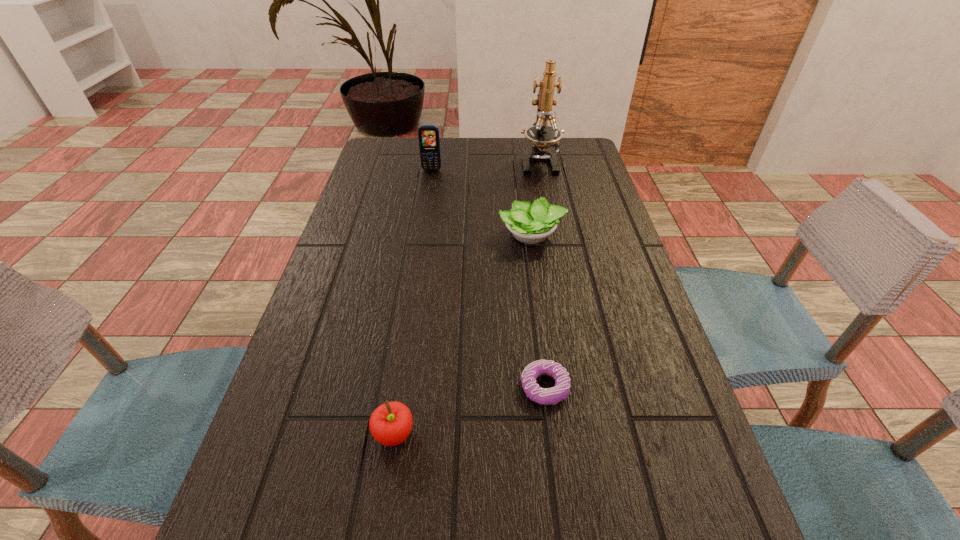
Find the location of a particular element. The height and width of the screenshot is (540, 960). blank region between the third nearest object and the microscope is located at coordinates (541, 275).

At what (x,y) coordinates should I click in order to perform the action: click on unoccupied area between the tallest object and the fifth shortest object. Please return your answer as a coordinate pair (x, y). The width and height of the screenshot is (960, 540). Looking at the image, I should click on (485, 166).

Where is `unoccupied position between the third nearest object and the cellular telephone`? This screenshot has height=540, width=960. unoccupied position between the third nearest object and the cellular telephone is located at coordinates click(x=489, y=279).

Find the location of `empty location between the apple and the third nearest object`. empty location between the apple and the third nearest object is located at coordinates (469, 411).

Locate an element on the screen. free space between the third farthest object and the second tallest object is located at coordinates coord(481,202).

Identify which object is the fifth nearest to the beeper. Please provide its 2D coordinates. Your answer should be formatted as a tuple, i.e. [(x, y)], where the tuple contains the x and y coordinates of a point satisfying the conditions above.

[(428, 135)]

Point out which object is positioned as the third nearest to the doughnut. Please provide its 2D coordinates. Your answer should be formatted as a tuple, i.e. [(x, y)], where the tuple contains the x and y coordinates of a point satisfying the conditions above.

[(529, 223)]

Locate an element on the screen. This screenshot has height=540, width=960. free space that satisfies the following two spatial constraints: 1. on the screen of the apple; 2. on the left side of the cellular telephone is located at coordinates (390, 434).

Locate an element on the screen. Image resolution: width=960 pixels, height=540 pixels. free region that satisfies the following two spatial constraints: 1. on the screen of the cellular telephone; 2. on the right side of the third farthest object is located at coordinates (421, 235).

Find the location of a particular element. free point that satisfies the following two spatial constraints: 1. on the screen of the lettuce; 2. on the right side of the second tallest object is located at coordinates pyautogui.click(x=421, y=235).